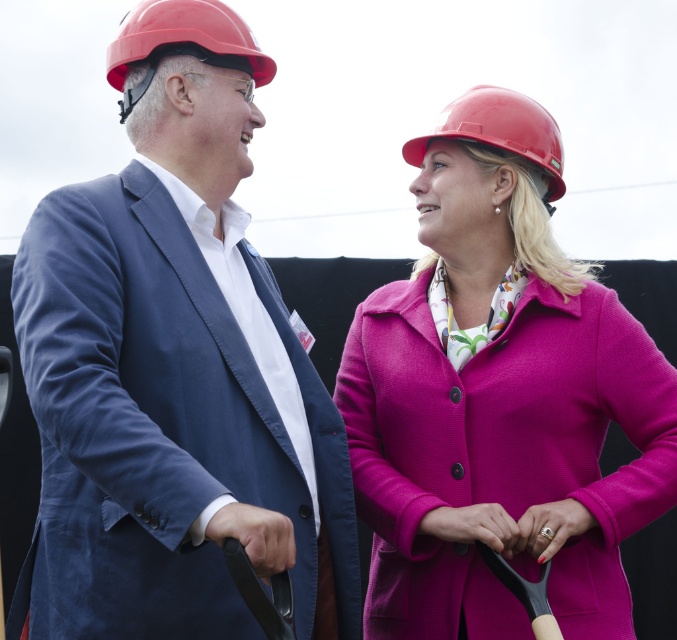
Question: Which point is closer to the camera?

Choices:
 (A) pink woolen coat at center
 (B) suede-like blue suit at left
 (C) pink fabric hand at center
 (D) black rubber handle at lower left

Answer: (D)

Question: Is suede-like blue suit at left smaller than black rubber handle at lower left?

Choices:
 (A) yes
 (B) no

Answer: (A)

Question: Does suede-like blue suit at left appear on the right side of matte red hard hat at upper left?

Choices:
 (A) yes
 (B) no

Answer: (A)

Question: Can you confirm if pink woolen coat at center is positioned to the right of black rubber handle at lower left?

Choices:
 (A) no
 (B) yes

Answer: (B)

Question: Which point is farther from the camera taking this photo?

Choices:
 (A) (542, 128)
 (B) (156, 44)

Answer: (A)

Question: Which object appears farthest from the camera in this image?

Choices:
 (A) matte red hard hat at upper left
 (B) red hard hat at upper center
 (C) pink fabric hand at center
 (D) gold ring at center

Answer: (B)